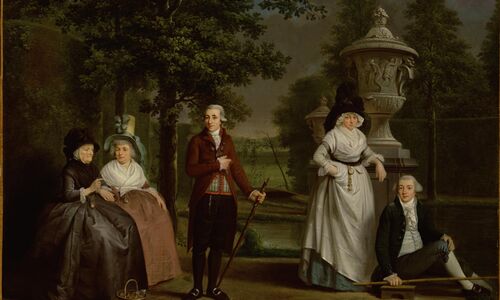
The width and height of the screenshot is (500, 300). Identify the location of painting. (247, 88).